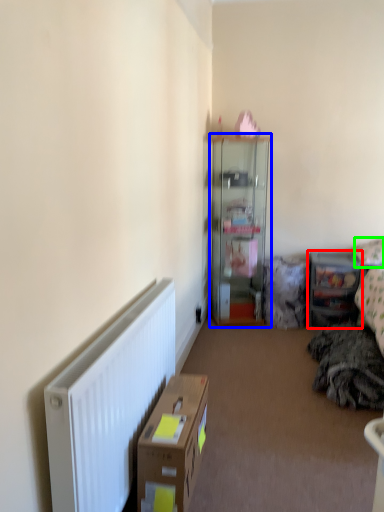
Question: Considering the real-world distances, which object is closest to shelf (highlighted by a red box)? cabinetry (highlighted by a blue box) or pillow (highlighted by a green box).

Choices:
 (A) cabinetry
 (B) pillow

Answer: (B)